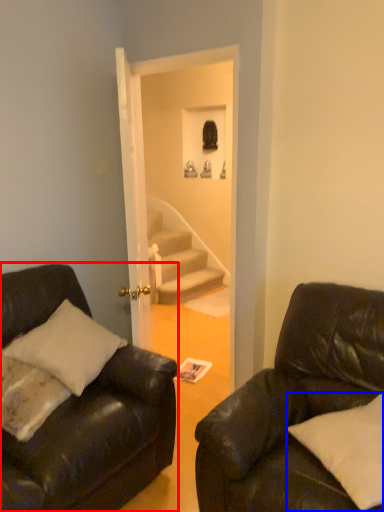
Question: Which of the following is the closest to the observer, studio couch (highlighted by a red box) or pillow (highlighted by a blue box)?

Choices:
 (A) studio couch
 (B) pillow

Answer: (A)